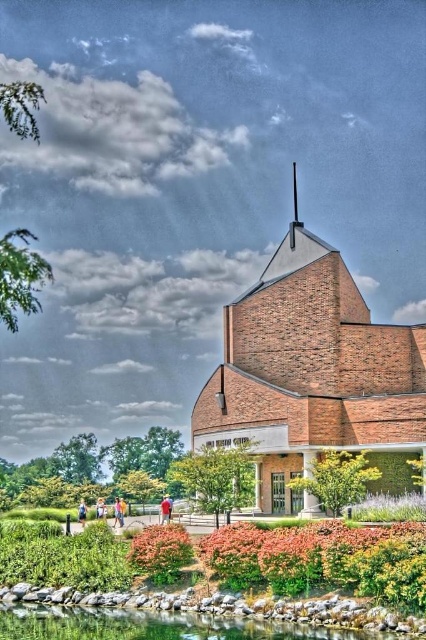
Question: Is clear glass water at lower center above blue denim jeans at lower center?

Choices:
 (A) yes
 (B) no

Answer: (A)

Question: Is pink fabric dress at lower center smaller than light blue denim jeans at lower left?

Choices:
 (A) no
 (B) yes

Answer: (A)

Question: Which point appears closest to the camera in this image?

Choices:
 (A) (181, 611)
 (B) (97, 500)
 (C) (115, 500)

Answer: (A)

Question: Which object is farther from the camera taking this photo?

Choices:
 (A) orange matte flower at lower center
 (B) clear glass water at lower center
 (C) brick building at center
 (D) light blue denim jeans at lower left

Answer: (D)

Question: Which object is farther from the camera taking this photo?

Choices:
 (A) brick building at center
 (B) pink fabric dress at lower center

Answer: (B)

Question: Where is orange matte flower at lower center located in relation to pink fabric dress at lower center in the image?

Choices:
 (A) below
 (B) above

Answer: (B)